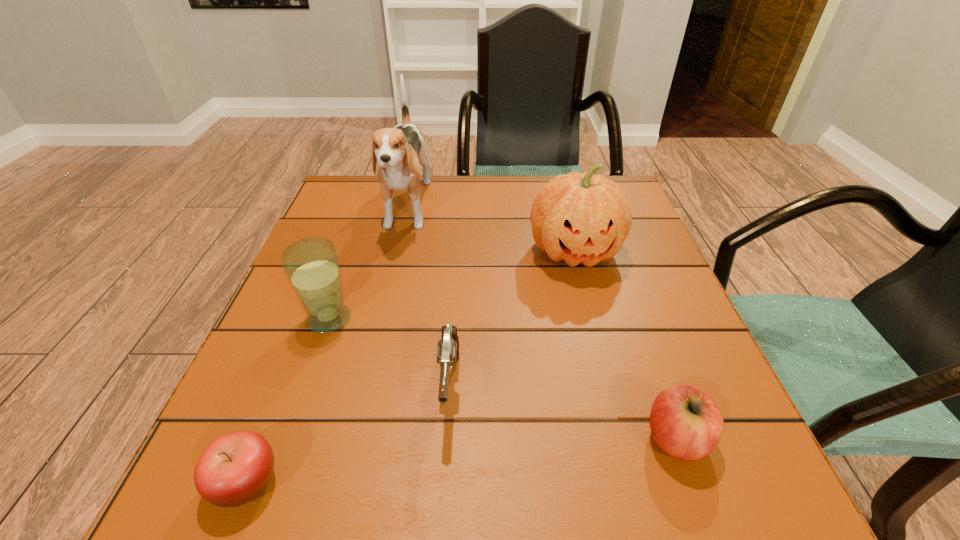
Identify the location of apple that is positioned at the right edge. (685, 422).

Image resolution: width=960 pixels, height=540 pixels. What are the coordinates of `object present at the far left corner` in the screenshot? It's located at (399, 151).

Find the location of a particular element. This screenshot has width=960, height=540. object positioned at the near left corner is located at coordinates (236, 467).

Image resolution: width=960 pixels, height=540 pixels. In order to click on object that is positioned at the far right corner in this screenshot , I will do `click(584, 218)`.

This screenshot has width=960, height=540. In order to click on object located in the near right corner section of the desktop in this screenshot , I will do `click(685, 422)`.

Find the location of `vacant space at the far edge of the desktop`. vacant space at the far edge of the desktop is located at coordinates (484, 219).

At what (x,y) coordinates should I click in order to perform the action: click on free region at the near edge of the desktop. Please return your answer as a coordinate pair (x, y). This screenshot has height=540, width=960. Looking at the image, I should click on (616, 514).

This screenshot has height=540, width=960. I want to click on blank area at the left edge, so click(283, 304).

I want to click on vacant space at the right edge, so click(x=683, y=367).

Image resolution: width=960 pixels, height=540 pixels. I want to click on vacant space at the far left corner of the desktop, so click(379, 216).